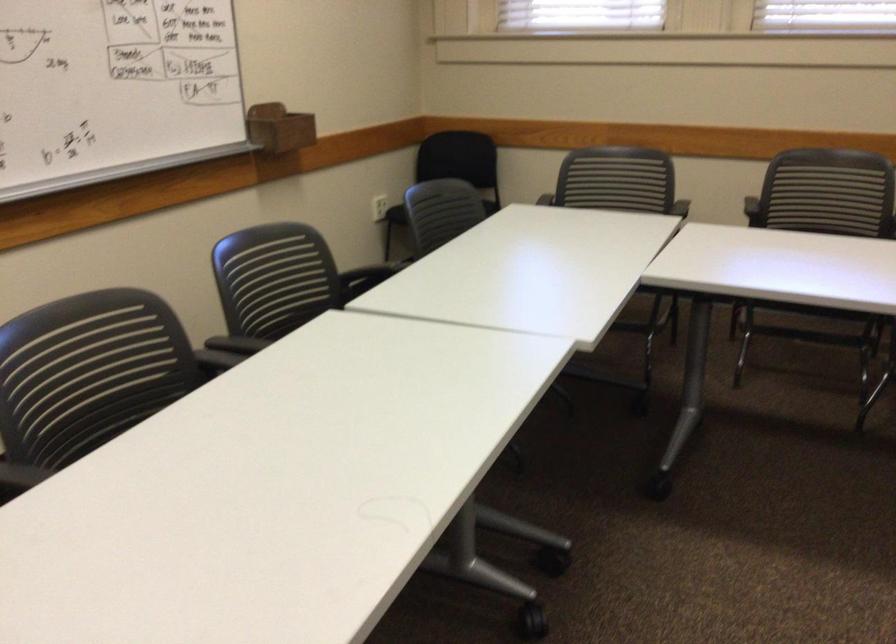
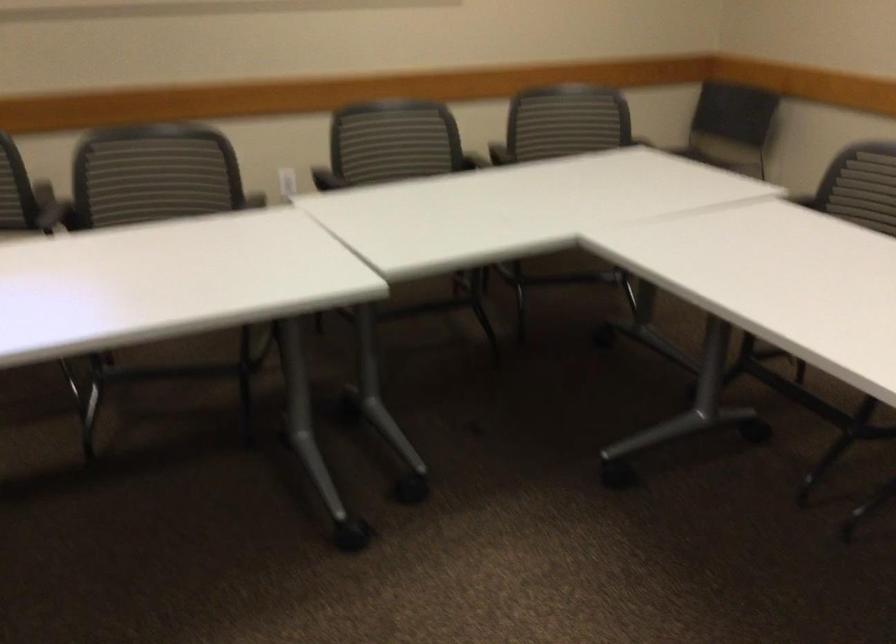
Question: The images are taken continuously from a first-person perspective. In which direction is your viewpoint rotating?

Choices:
 (A) Left
 (B) Right
 (C) Up
 (D) Down

Answer: (B)